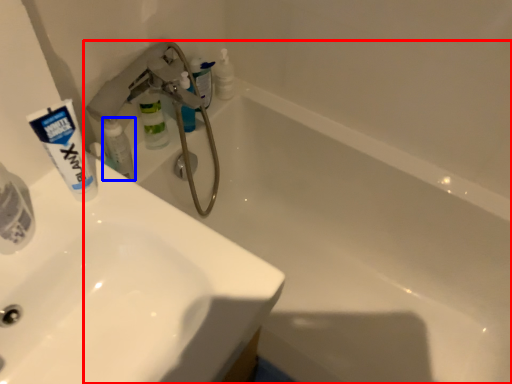
Question: Which object appears closest to the camera in this image, bathtub (highlighted by a red box) or toiletry (highlighted by a blue box)?

Choices:
 (A) bathtub
 (B) toiletry

Answer: (A)